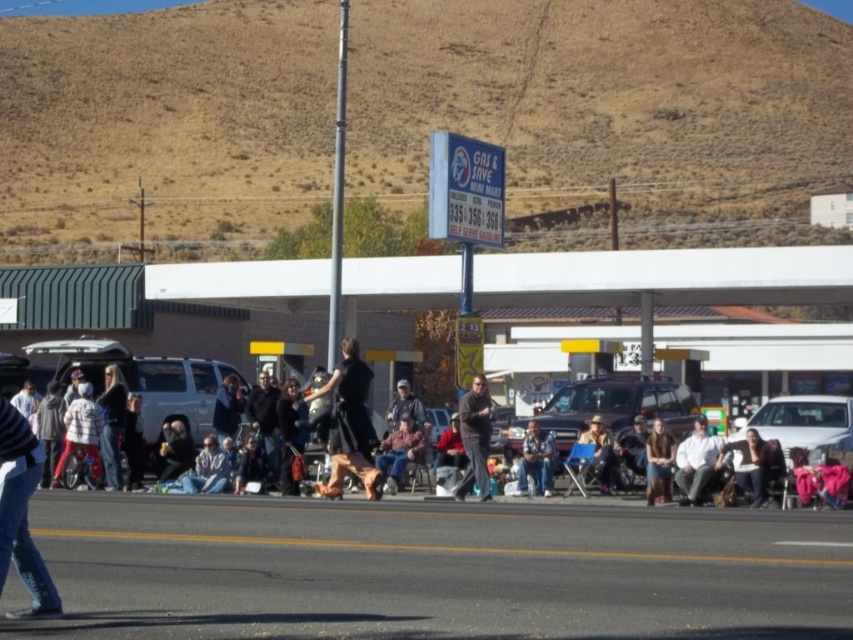
You are a photographer standing at the back of the scene. You want to take a photo of the dark gray sweater at center without the black fabric crowd at center blocking it. Is this possible?

The dark gray sweater at center is behind the black fabric crowd at center, so it is already blocked by the crowd. Therefore, you cannot take a photo of the dark gray sweater at center without the black fabric crowd at center blocking it.